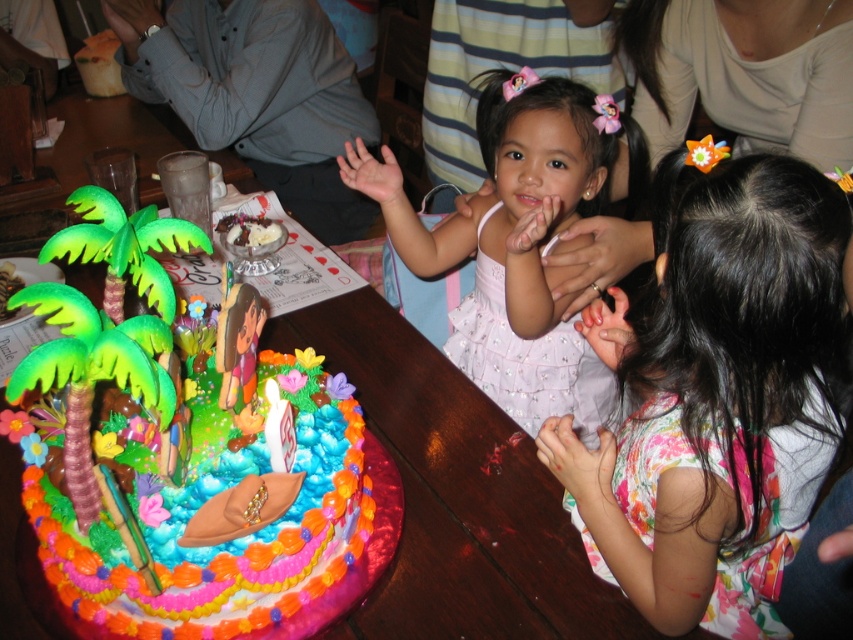
You are a photographer at a birthday party. You need to position yourself so that the multicolored fondant cake at left and the pink satin dress at center are both in your camera frame. Based on their positions, which object should you place closer to the left side of your camera frame?

The multicolored fondant cake at left is to the left of the pink satin dress at center, so you should position the multicolored fondant cake at left closer to the left side of your camera frame.

You are a photographer at the birthday party and want to take a photo of the multicolored fondant cake at left and the pink satin dress at center so that both are clearly visible. Considering their heights, which object should you position closer to the camera to ensure both are fully visible in the photo?

The multicolored fondant cake at left has a lesser height compared to the pink satin dress at center. To ensure both are fully visible, position the multicolored fondant cake at left closer to the camera so that its smaller size doesn

You are a photographer at a birthday party and want to capture a photo of the multicolored fondant cake at left and the white paper birthday candle at center. From the perspective of the photographer, which object is located to the right?

The white paper birthday candle at center is located to the right of the multicolored fondant cake at left.